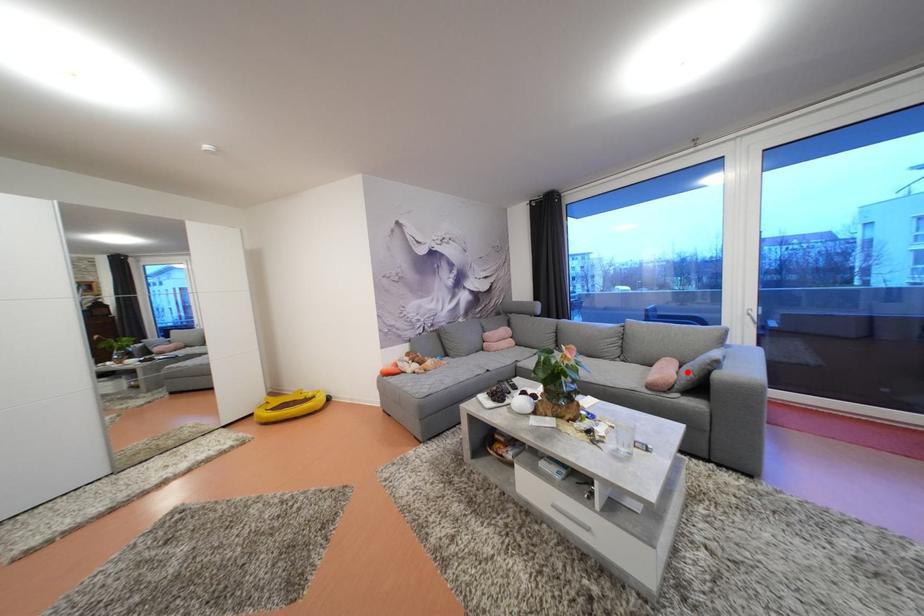
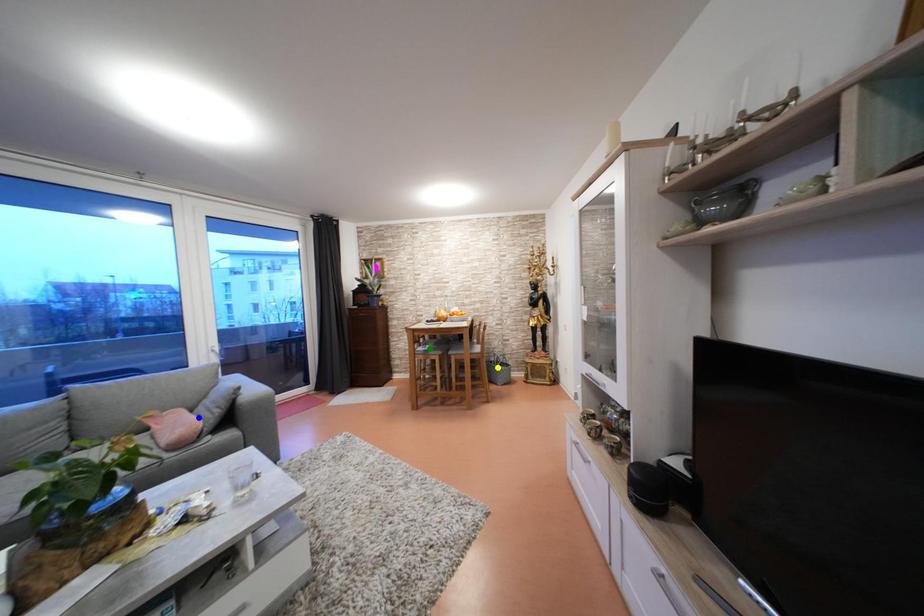
Question: I am providing you with two images of the same scene from different viewpoints. A red point is marked on the first image. You are given multiple points on the second image. Which point in image 2 represents the same 3d spot as the red point in image 1?

Choices:
 (A) blue point
 (B) green point
 (C) yellow point

Answer: (A)